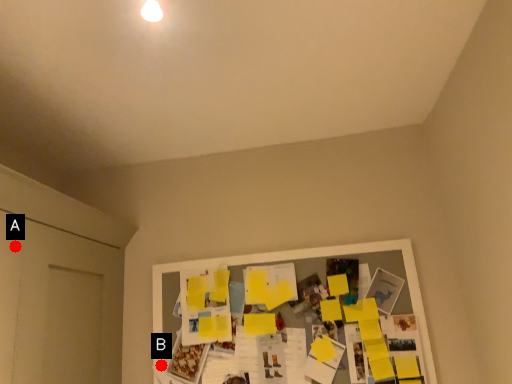
Question: Two points are circled on the image, labeled by A and B beside each circle. Which point appears farthest from the camera in this image?

Choices:
 (A) A is further
 (B) B is further

Answer: (B)